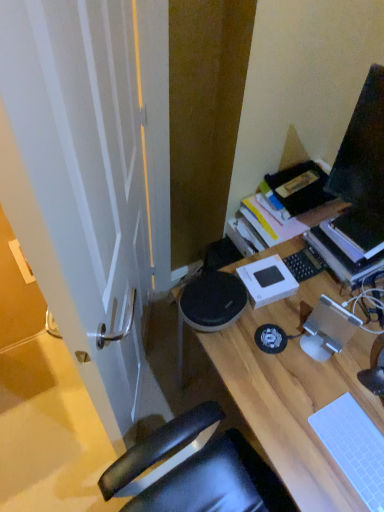
Image resolution: width=384 pixels, height=512 pixels. In order to click on free spot to the left of white matte laptop keyboard at lower right, which is the first laptop keyboard in front-to-back order in this screenshot , I will do `click(296, 445)`.